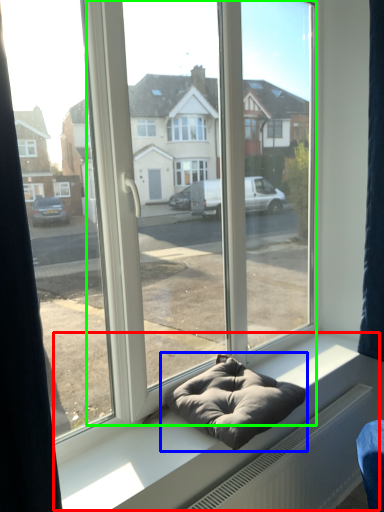
Question: Estimate the real-world distances between objects in this image. Which object is farther from window sill (highlighted by a red box), bean bag chair (highlighted by a blue box) or glass door (highlighted by a green box)?

Choices:
 (A) bean bag chair
 (B) glass door

Answer: (B)